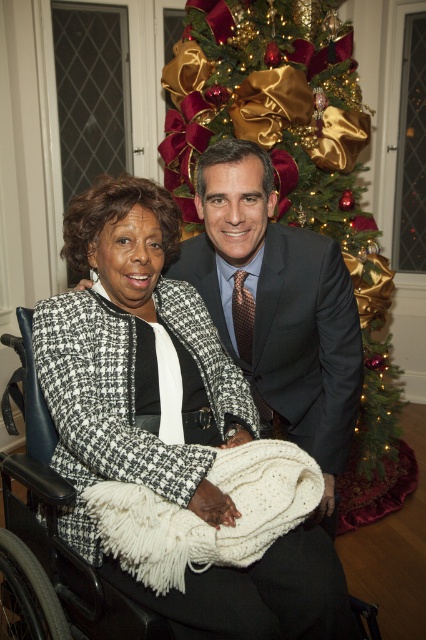
Based on the photo, between gold shiny tinsel at upper center and black plastic wheelchair at lower left, which one is positioned higher?

Positioned higher is gold shiny tinsel at upper center.

Who is positioned more to the right, gold shiny tinsel at upper center or black plastic wheelchair at lower left?

gold shiny tinsel at upper center

Is point (227, 88) less distant than point (60, 588)?

That is False.

Image resolution: width=426 pixels, height=640 pixels. What are the coordinates of `gold shiny tinsel at upper center` in the screenshot? It's located at (293, 156).